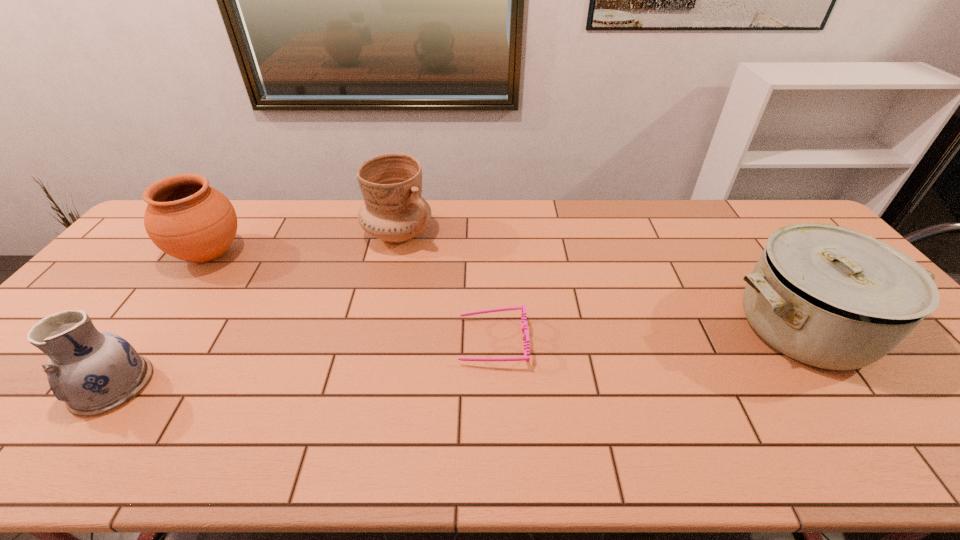
The height and width of the screenshot is (540, 960). Identify the location of the rightmost pottery. (393, 211).

The height and width of the screenshot is (540, 960). Find the location of `saucepan`. saucepan is located at coordinates (831, 297).

Where is `the nearest pottery`? The width and height of the screenshot is (960, 540). the nearest pottery is located at coordinates (93, 372).

The width and height of the screenshot is (960, 540). What are the coordinates of `the shortest object` in the screenshot? It's located at (525, 337).

Locate an element on the screen. the second object from right to left is located at coordinates (525, 337).

You are a GUI agent. You are given a task and a screenshot of the screen. Output one action in this format:
    pyautogui.click(x=<x>, y=<y>)
    Task: Click on the free space located on the left of the rightmost pottery
    The height and width of the screenshot is (540, 960).
    Given the screenshot: What is the action you would take?
    pyautogui.click(x=338, y=234)

Image resolution: width=960 pixels, height=540 pixels. Identify the location of free region located 0.090m on the back of the saucepan. (758, 264).

At what (x,y) coordinates should I click in order to perform the action: click on free space located on the back of the nearest pottery. Please return your answer as a coordinate pair (x, y). Image resolution: width=960 pixels, height=540 pixels. Looking at the image, I should click on (192, 276).

Locate an element on the screen. free space located 0.290m on the arms of the fourth object from left to right is located at coordinates (346, 341).

Identify the location of free space located 0.060m on the arms of the fourth object from left to right. (435, 341).